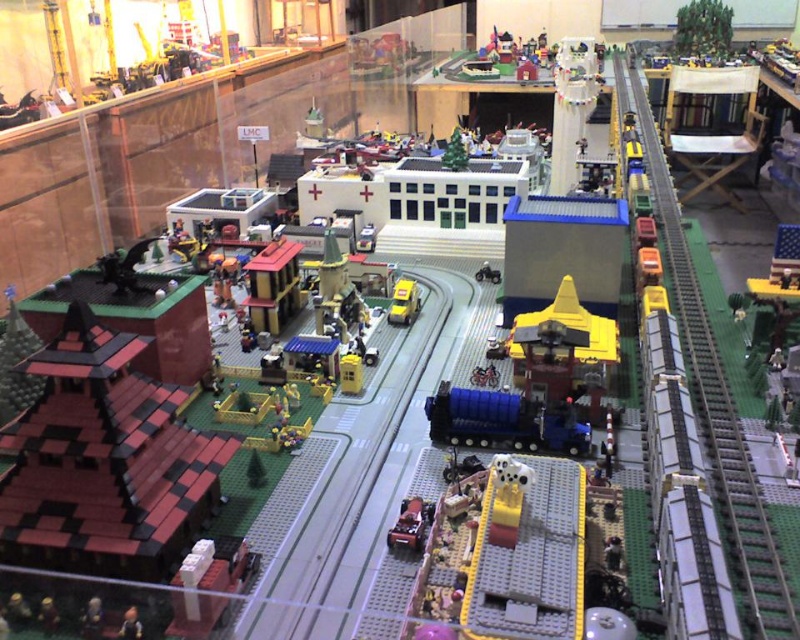
Question: Does green plastic train track at right appear on the left side of metallic silver train at center?

Choices:
 (A) yes
 (B) no

Answer: (B)

Question: Which point is farther to the camera?

Choices:
 (A) (764, 538)
 (B) (400, 522)

Answer: (B)

Question: Which object appears closest to the camera in this image?

Choices:
 (A) green plastic train track at right
 (B) yellow plastic car at center

Answer: (A)

Question: Which point appears closest to the camera in this image?

Choices:
 (A) (414, 524)
 (B) (760, 547)
 (C) (404, 280)

Answer: (B)

Question: Can you confirm if green plastic train track at right is thinner than metallic silver train at center?

Choices:
 (A) yes
 (B) no

Answer: (B)

Question: Does green plastic train track at right have a smaller size compared to yellow plastic car at center?

Choices:
 (A) yes
 (B) no

Answer: (B)